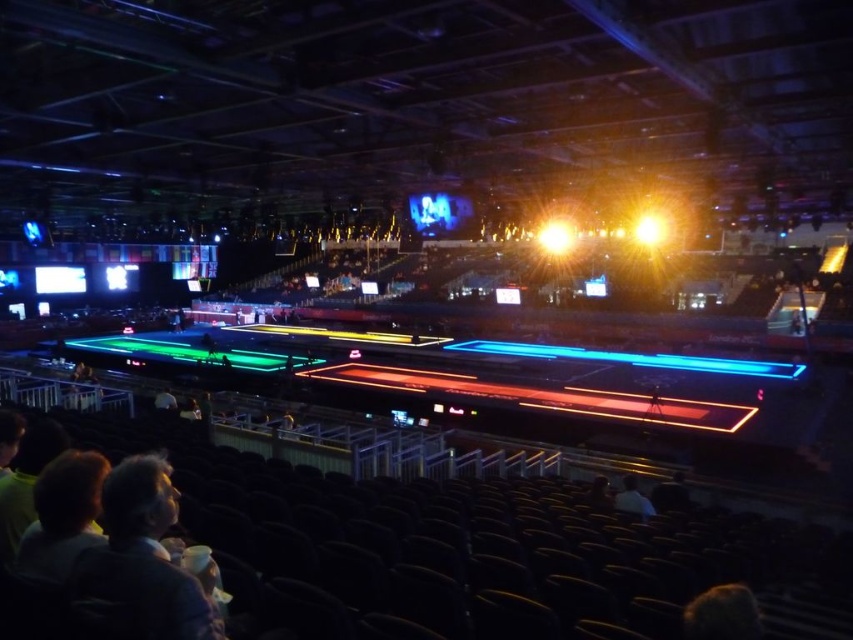
You are a stagehand in the indoor arena and need to locate the bright yellow spotlight at center. According to the arena map, where exactly is it positioned?

The bright yellow spotlight at center is positioned at point (556, 236).

Consider the image. You are a photographer trying to capture a clear shot of the white fabric shirt at lower right without the bright yellow spotlight at center overlapping it. Can you position yourself in a way to avoid the spotlight?

The bright yellow spotlight at center is wider than the white fabric shirt at lower right, so positioning yourself to avoid the spotlight might be challenging as the spotlight covers a larger area. You may need to adjust your angle or move closer to the shirt to minimize overlap.

You are a stagehand preparing to adjust the height of the bright yellow spotlight at center so it can illuminate the dark gray fabric jacket at lower right. Based on their current positions, do you need to raise or lower the spotlight to achieve this?

The bright yellow spotlight at center is much taller than the dark gray fabric jacket at lower right. To illuminate the jacket, you need to lower the spotlight.